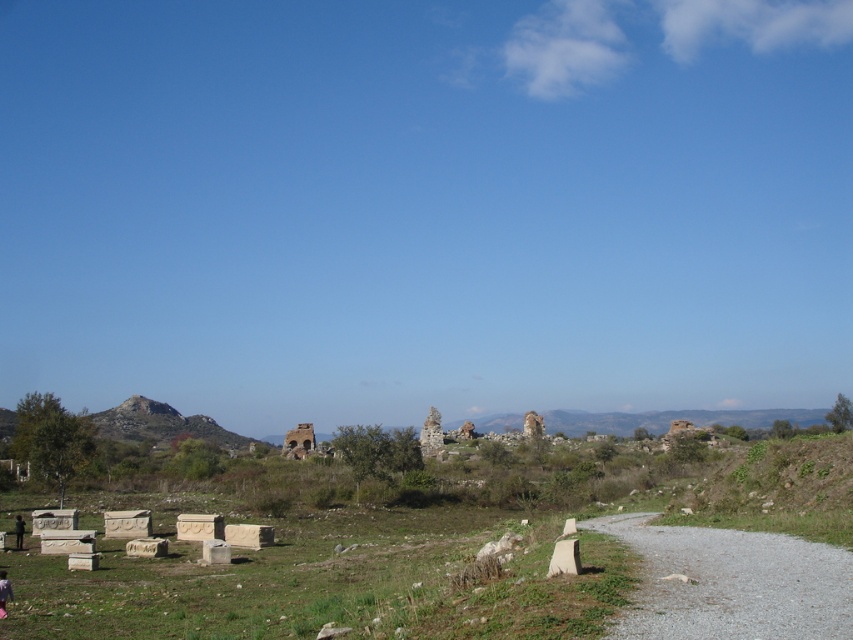
Can you confirm if gravelly dirt path at lower right is positioned above weathered stone ruins at center?

Correct, gravelly dirt path at lower right is located above weathered stone ruins at center.

At what (x,y) coordinates should I click in order to perform the action: click on gravelly dirt path at lower right. Please return your answer as a coordinate pair (x, y). Looking at the image, I should click on (730, 582).

Who is more forward, (x=708, y=618) or (x=430, y=428)?

Point (x=708, y=618)

This screenshot has height=640, width=853. I want to click on gravelly dirt path at lower right, so click(730, 582).

In the scene shown: Does gravelly dirt path at lower right have a greater width compared to dark green fabric at lower left?

Indeed, gravelly dirt path at lower right has a greater width compared to dark green fabric at lower left.

Can you confirm if gravelly dirt path at lower right is positioned below dark green fabric at lower left?

No.

This screenshot has width=853, height=640. Identify the location of gravelly dirt path at lower right. tap(730, 582).

Is pink fabric pants at lower left in front of dark green fabric at lower left?

Yes, pink fabric pants at lower left is in front of dark green fabric at lower left.

Is point (6, 600) closer to viewer compared to point (19, 544)?

Yes, point (6, 600) is closer to viewer.

The width and height of the screenshot is (853, 640). I want to click on pink fabric pants at lower left, so click(4, 593).